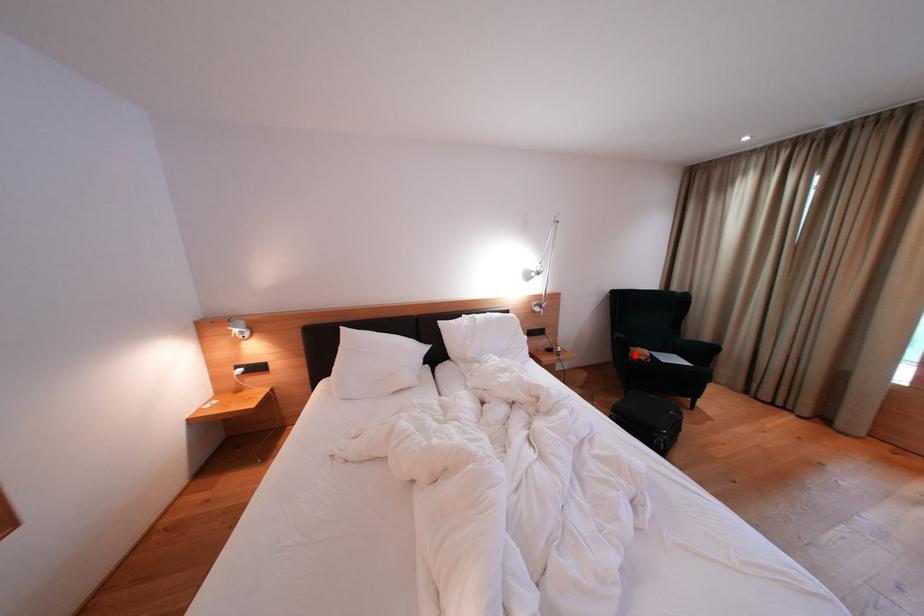
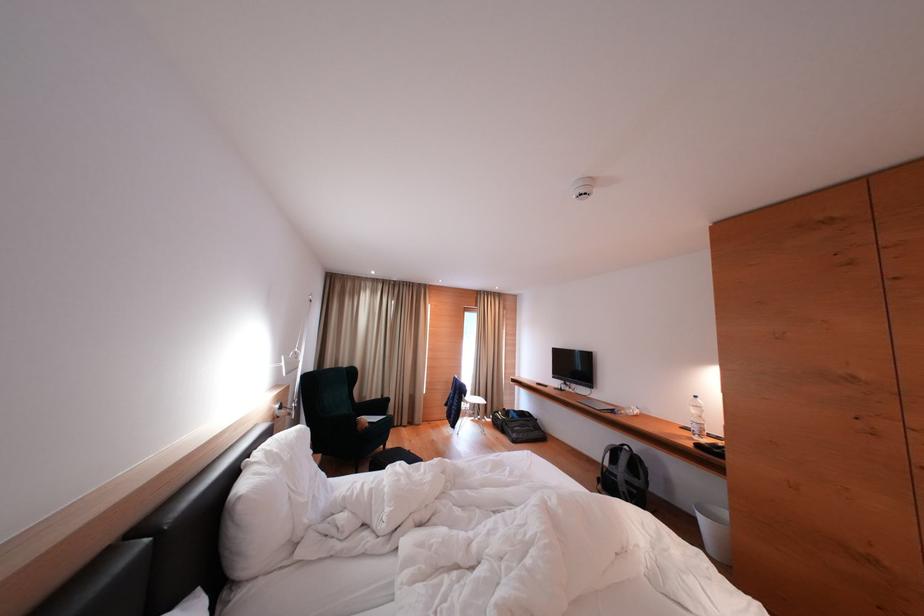
In the second image, find the point that corresponds to the highlighted location in the first image.

(362, 428)